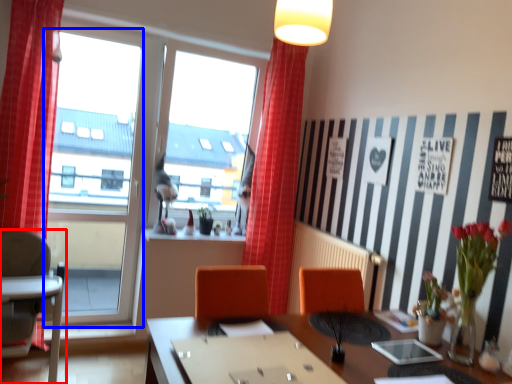
Question: Which of the following is the farthest to the observer, chair (highlighted by a red box) or window frame (highlighted by a blue box)?

Choices:
 (A) chair
 (B) window frame

Answer: (B)